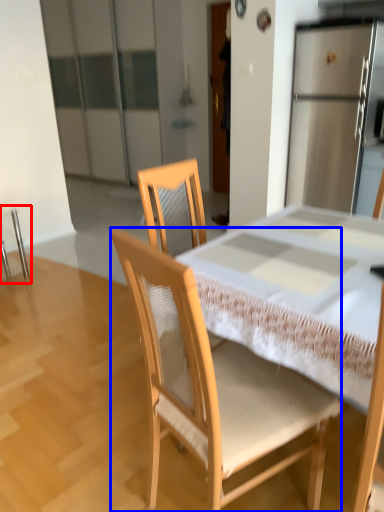
Question: Among these objects, which one is nearest to the camera, chair (highlighted by a red box) or chair (highlighted by a blue box)?

Choices:
 (A) chair
 (B) chair

Answer: (B)